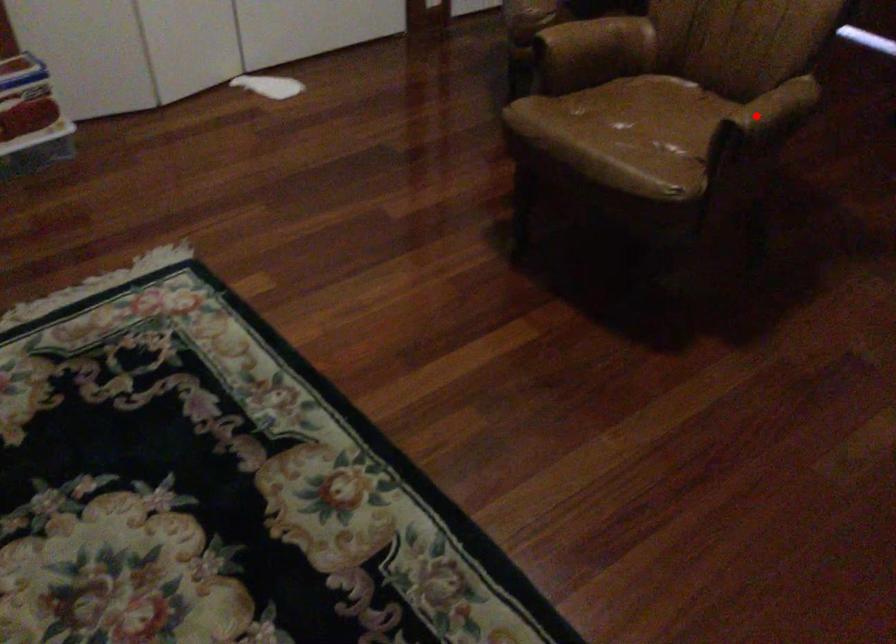
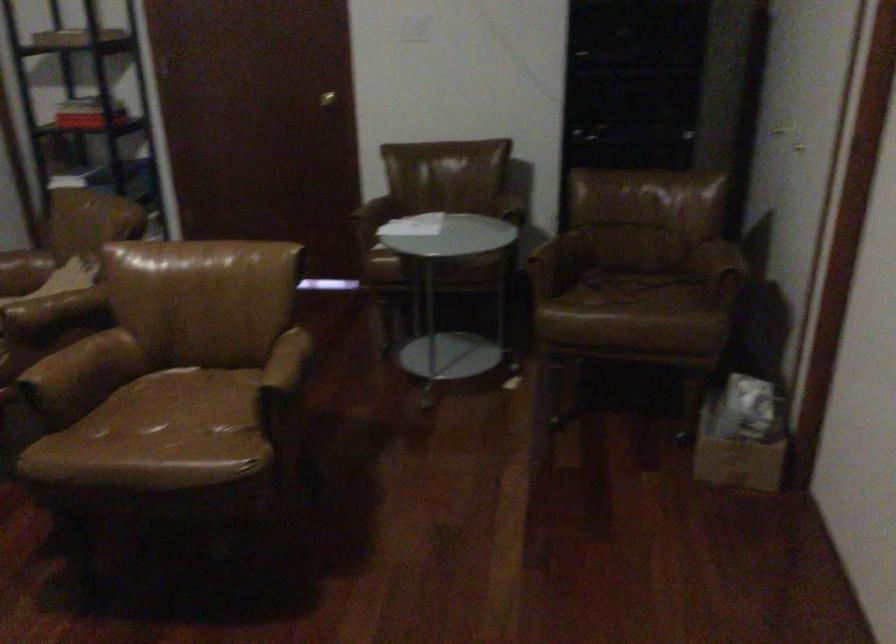
Find the pixel in the second image that matches the highlighted location in the first image.

(283, 371)